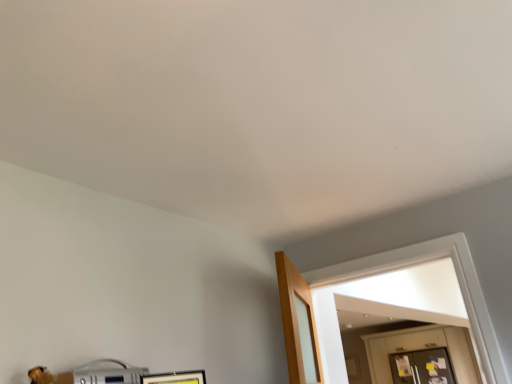
Question: From the image's perspective, relative to wooden door at lower right, is clear glass door at right above or below?

Choices:
 (A) above
 (B) below

Answer: (B)

Question: Visually, is clear glass door at right positioned to the left or to the right of wooden door at lower right?

Choices:
 (A) left
 (B) right

Answer: (A)

Question: Does point (403, 380) appear closer or farther from the camera than point (463, 377)?

Choices:
 (A) closer
 (B) farther

Answer: (B)

Question: Visually, is wooden door at lower right positioned to the left or to the right of clear glass door at right?

Choices:
 (A) right
 (B) left

Answer: (A)

Question: Is wooden door at lower right situated inside clear glass door at right or outside?

Choices:
 (A) outside
 (B) inside

Answer: (A)

Question: Looking at their shapes, would you say wooden door at lower right is wider or thinner than clear glass door at right?

Choices:
 (A) thin
 (B) wide

Answer: (B)

Question: From their relative heights in the image, would you say wooden door at lower right is taller or shorter than clear glass door at right?

Choices:
 (A) tall
 (B) short

Answer: (A)